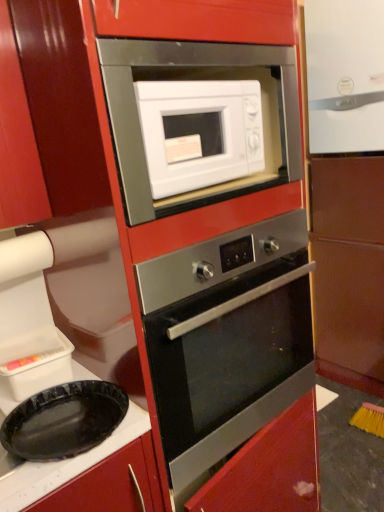
In order to click on free space above black plastic plate at lower left (from a real-world perspective) in this screenshot , I will do `click(55, 422)`.